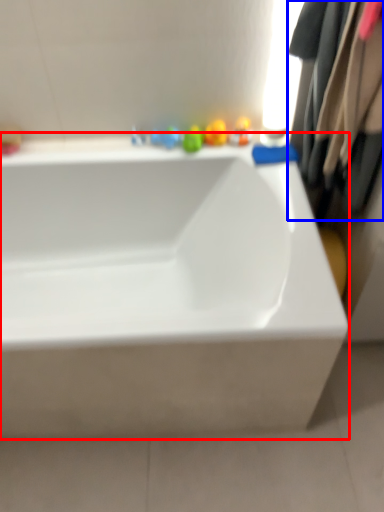
Question: Among these objects, which one is farthest to the camera, bathtub (highlighted by a red box) or clothing (highlighted by a blue box)?

Choices:
 (A) bathtub
 (B) clothing

Answer: (A)